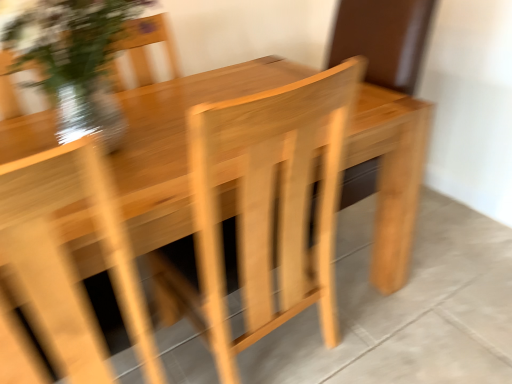
Identify the location of translucent glass vase at upper left. This screenshot has width=512, height=384. (74, 60).

What do you see at coordinates (177, 144) in the screenshot? Image resolution: width=512 pixels, height=384 pixels. I see `natural wood table at center` at bounding box center [177, 144].

In order to click on translucent glass vase at upper left in this screenshot , I will do `click(74, 60)`.

Can you confirm if natural wood table at center is wider than natural wood table at center?

No.

Find the location of a particular element. The image size is (512, 384). table that appears above the natural wood table at center (from the image's perspective) is located at coordinates (177, 144).

Looking at this image, is natural wood table at center at the left side of natural wood table at center?

Indeed, natural wood table at center is positioned on the left side of natural wood table at center.

Which is closer to the camera, [181,116] or [124,370]?

The point [124,370] is more forward.

Consider the image. From the image's perspective, which is below, translucent glass vase at upper left or natural wood armchair at center?

From the image's view, natural wood armchair at center is below.

Can you tell me how much translucent glass vase at upper left and natural wood armchair at center differ in facing direction?

translucent glass vase at upper left and natural wood armchair at center are facing 180 degrees away from each other.

At what (x,y) coordinates should I click in order to perform the action: click on armchair below the translucent glass vase at upper left (from a real-world perspective). Please return your answer as a coordinate pair (x, y). The height and width of the screenshot is (384, 512). Looking at the image, I should click on (271, 203).

Can you confirm if translucent glass vase at upper left is positioned to the left of natural wood armchair at center?

Indeed, translucent glass vase at upper left is positioned on the left side of natural wood armchair at center.

Is natural wood table at center located outside natural wood armchair at center?

That's correct, natural wood table at center is outside of natural wood armchair at center.

Which is less distant, (55, 126) or (327, 306)?

Point (55, 126) is positioned farther from the camera compared to point (327, 306).

Could you tell me if natural wood table at center is facing natural wood armchair at center?

Yes.

From a real-world perspective, is translucent glass vase at upper left positioned over natural wood table at center based on gravity?

Yes, from a real-world perspective, translucent glass vase at upper left is over natural wood table at center

Between translucent glass vase at upper left and natural wood table at center, which one is positioned behind?

translucent glass vase at upper left is further away from the camera.

This screenshot has width=512, height=384. Identify the location of table lying below the translucent glass vase at upper left (from the image's perspective). (177, 144).

From the image's perspective, relative to natural wood table at center, is translucent glass vase at upper left above or below?

Clearly, from the image's perspective, translucent glass vase at upper left is above natural wood table at center.

Considering the points (403, 238) and (81, 116), which point is in front, point (403, 238) or point (81, 116)?

Positioned in front is point (81, 116).

Is natural wood table at center closer to camera compared to translucent glass vase at upper left?

Yes, natural wood table at center is closer to the camera.

From a real-world perspective, who is located lower, natural wood table at center or translucent glass vase at upper left?

natural wood table at center, from a real-world perspective.

From the image's perspective, is natural wood table at center located above or below translucent glass vase at upper left?

natural wood table at center is situated lower than translucent glass vase at upper left in the image.

Could you tell me if natural wood table at center is facing natural wood armchair at center?

No, natural wood table at center is not aimed at natural wood armchair at center.

Measure the distance from natural wood table at center to natural wood armchair at center.

20.07 inches.

Which of these two, natural wood table at center or natural wood armchair at center, is wider?

Wider between the two is natural wood table at center.

From a real-world perspective, is natural wood table at center positioned over natural wood armchair at center based on gravity?

Actually, natural wood table at center is physically below natural wood armchair at center in the real world.

Where is `armchair that appears below the translucent glass vase at upper left (from the image's perspective)`? armchair that appears below the translucent glass vase at upper left (from the image's perspective) is located at coordinates (271, 203).

From a real-world perspective, relative to translucent glass vase at upper left, is natural wood armchair at center vertically above or below?

From a real-world perspective, natural wood armchair at center is physically below translucent glass vase at upper left.

Which is more to the left, natural wood armchair at center or translucent glass vase at upper left?

Positioned to the left is translucent glass vase at upper left.

Is natural wood armchair at center not near translucent glass vase at upper left?

They are positioned close to each other.

This screenshot has width=512, height=384. Identify the location of table on the left of natural wood table at center. (177, 144).

Where is `armchair in front of the translucent glass vase at upper left`? The height and width of the screenshot is (384, 512). armchair in front of the translucent glass vase at upper left is located at coordinates (271, 203).

From the picture: Looking at the image, which one is located further to natural wood table at center, translucent glass vase at upper left or natural wood armchair at center?

The object further to natural wood table at center is translucent glass vase at upper left.

Looking at the image, which one is located further to natural wood armchair at center, natural wood table at center or natural wood table at center?

natural wood table at center lies further to natural wood armchair at center than the other object.

Based on their spatial positions, is natural wood table at center or translucent glass vase at upper left closer to natural wood armchair at center?

natural wood table at center lies closer to natural wood armchair at center than the other object.

From the image, which object appears to be nearer to natural wood armchair at center, translucent glass vase at upper left or natural wood table at center?

natural wood table at center is closer to natural wood armchair at center.

Consider the image. Estimate the real-world distances between objects in this image. Which object is further from natural wood armchair at center, natural wood table at center or translucent glass vase at upper left?

translucent glass vase at upper left is further to natural wood armchair at center.

When comparing their distances from natural wood table at center, does natural wood armchair at center or translucent glass vase at upper left seem closer?

natural wood armchair at center is closer to natural wood table at center.

From the image, which object appears to be nearer to natural wood table at center, natural wood table at center or natural wood armchair at center?

The object closer to natural wood table at center is natural wood armchair at center.

From the image, which object appears to be nearer to natural wood table at center, natural wood table at center or natural wood armchair at center?

natural wood armchair at center is positioned closer to the anchor natural wood table at center.

Locate an element on the screen. table situated between translucent glass vase at upper left and natural wood table at center from left to right is located at coordinates (177, 144).

Where is `armchair between translucent glass vase at upper left and natural wood table at center`? The image size is (512, 384). armchair between translucent glass vase at upper left and natural wood table at center is located at coordinates (271, 203).

This screenshot has height=384, width=512. I want to click on armchair situated between natural wood table at center and natural wood table at center from left to right, so click(x=271, y=203).

I want to click on armchair between translucent glass vase at upper left and natural wood table at center in the vertical direction, so click(x=271, y=203).